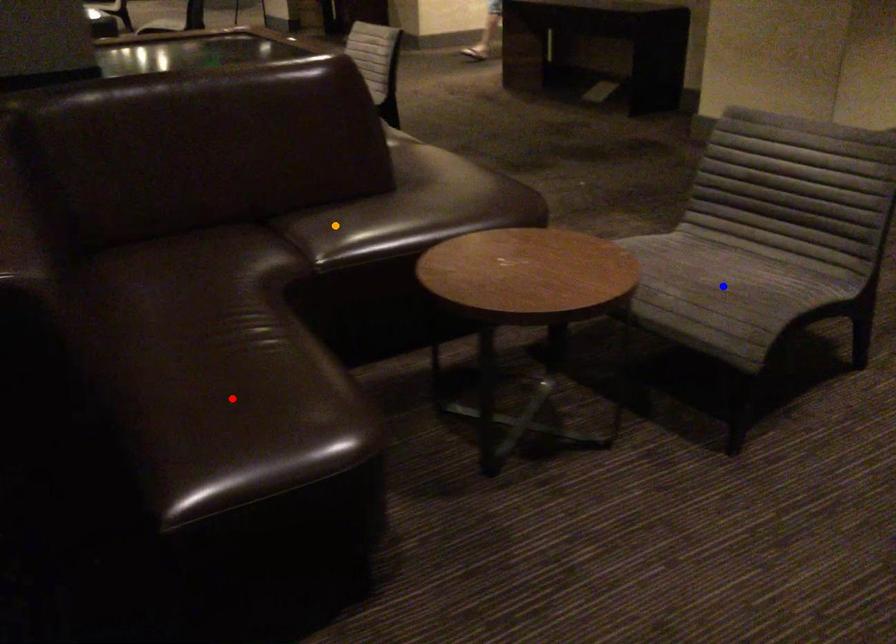
Order these from farthest to nearest:
1. red point
2. orange point
3. blue point

orange point → blue point → red point